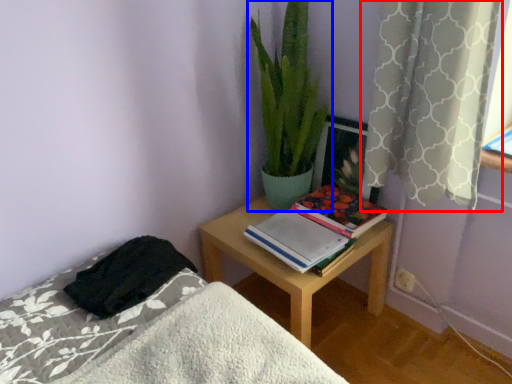
Question: Which of the following is the farthest to the observer, curtain (highlighted by a red box) or houseplant (highlighted by a blue box)?

Choices:
 (A) curtain
 (B) houseplant

Answer: (B)